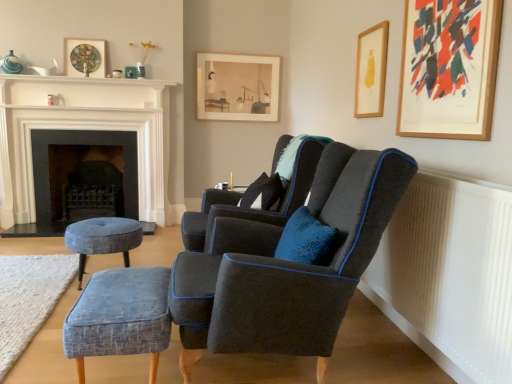
Where is `vacant space situated above white glossy fireplace at upper left, acting as the second fireplace starting from the back (from a real-world perspective)`? vacant space situated above white glossy fireplace at upper left, acting as the second fireplace starting from the back (from a real-world perspective) is located at coordinates (73, 84).